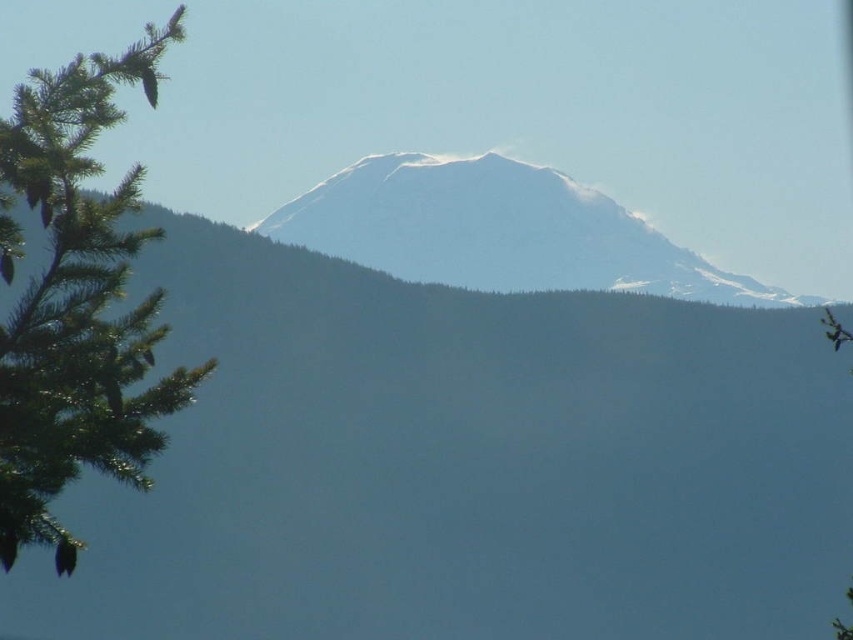
Question: Which point appears farthest from the camera in this image?

Choices:
 (A) (151, 72)
 (B) (479, 275)

Answer: (B)

Question: From the image, what is the correct spatial relationship of green needle-like leaves at left in relation to white snow-covered peak at center?

Choices:
 (A) below
 (B) above

Answer: (A)

Question: Can you confirm if green needle-like leaves at left is positioned to the right of white snow-covered peak at center?

Choices:
 (A) yes
 (B) no

Answer: (B)

Question: Is green needle-like leaves at left smaller than white snow-covered peak at center?

Choices:
 (A) no
 (B) yes

Answer: (A)